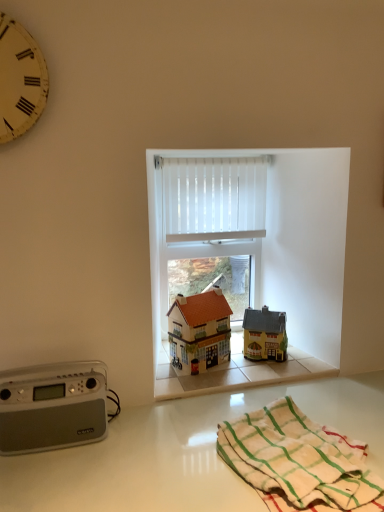
Find the location of a particular element. Image resolution: width=384 pixels, height=512 pixels. free point above white glossy countertop at lower center (from a real-world perspective) is located at coordinates (214, 443).